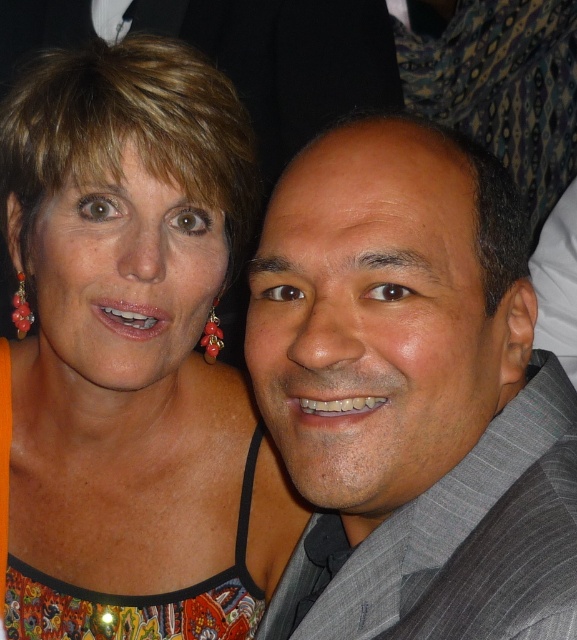
Question: Which point is farther to the camera?

Choices:
 (A) multicolored fabric dress at upper left
 (B) gray textured suit at center

Answer: (A)

Question: Is multicolored fabric dress at upper left wider than gray textured suit at center?

Choices:
 (A) yes
 (B) no

Answer: (A)

Question: Is multicolored fabric dress at upper left in front of gray textured suit at center?

Choices:
 (A) yes
 (B) no

Answer: (B)

Question: Considering the relative positions of multicolored fabric dress at upper left and gray textured suit at center in the image provided, where is multicolored fabric dress at upper left located with respect to gray textured suit at center?

Choices:
 (A) above
 (B) below

Answer: (A)